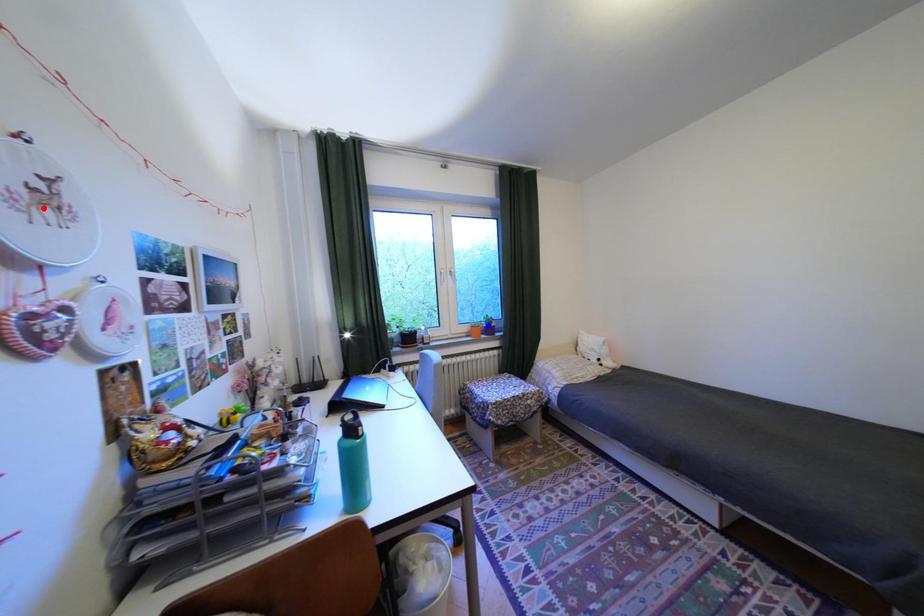
Question: Which of the two points in the image is closer to the camera?

Choices:
 (A) Blue point is closer.
 (B) Red point is closer.

Answer: (B)